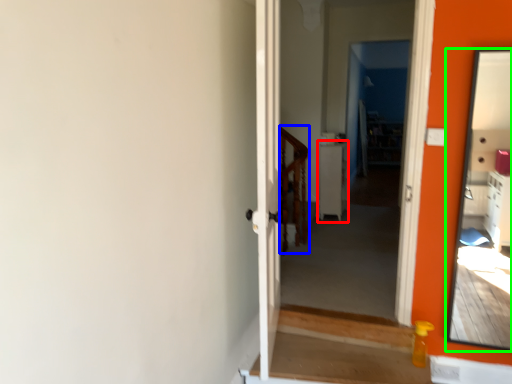
Question: Estimate the real-world distances between objects in this image. Which object is farther from table (highlighted by a red box), balustrade (highlighted by a blue box) or mirror (highlighted by a green box)?

Choices:
 (A) balustrade
 (B) mirror

Answer: (B)